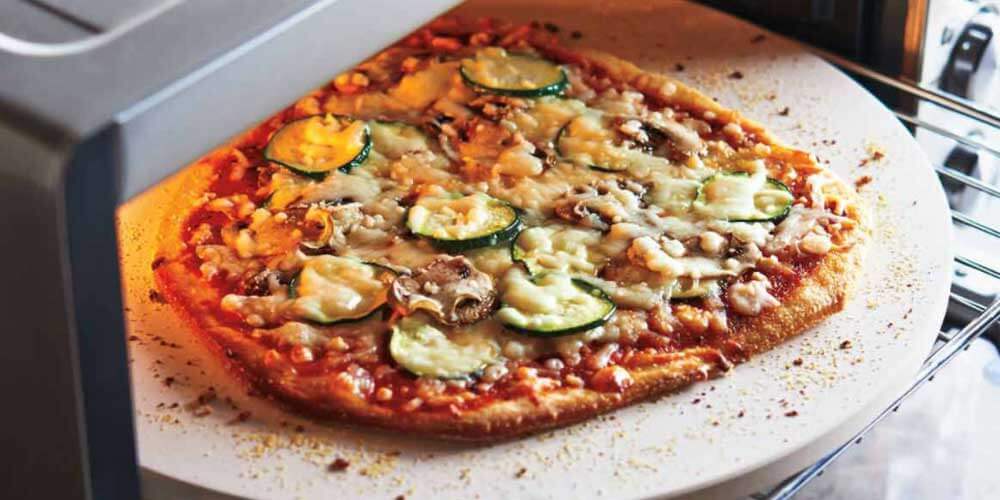
Where is `top of oven`? The image size is (1000, 500). top of oven is located at coordinates (178, 85).